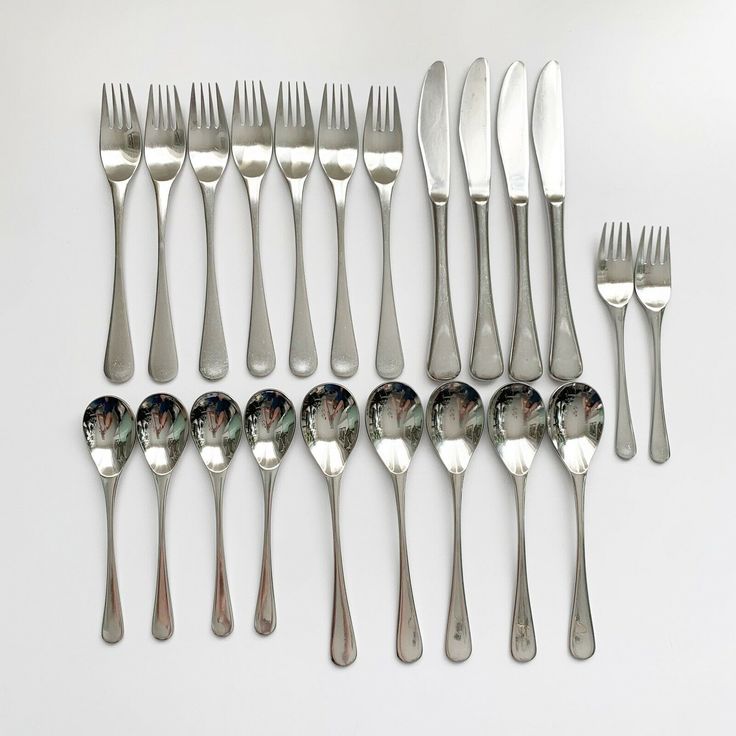
At what (x,y) coordinates should I click in order to perform the action: click on knife handles. Please return your answer as a coordinate pair (x, y). The height and width of the screenshot is (736, 736). Looking at the image, I should click on (449, 358), (484, 353), (527, 361), (561, 357).